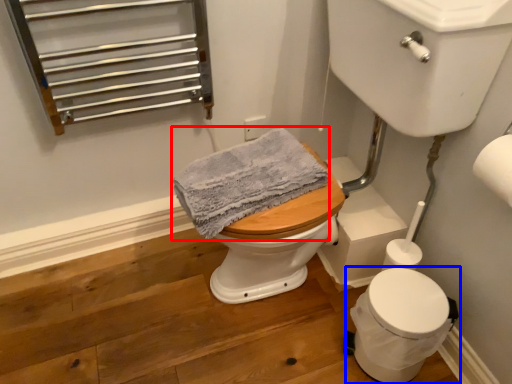
Question: Which point is further to the camera, bath towel (highlighted by a red box) or toilet (highlighted by a blue box)?

Choices:
 (A) bath towel
 (B) toilet

Answer: (B)